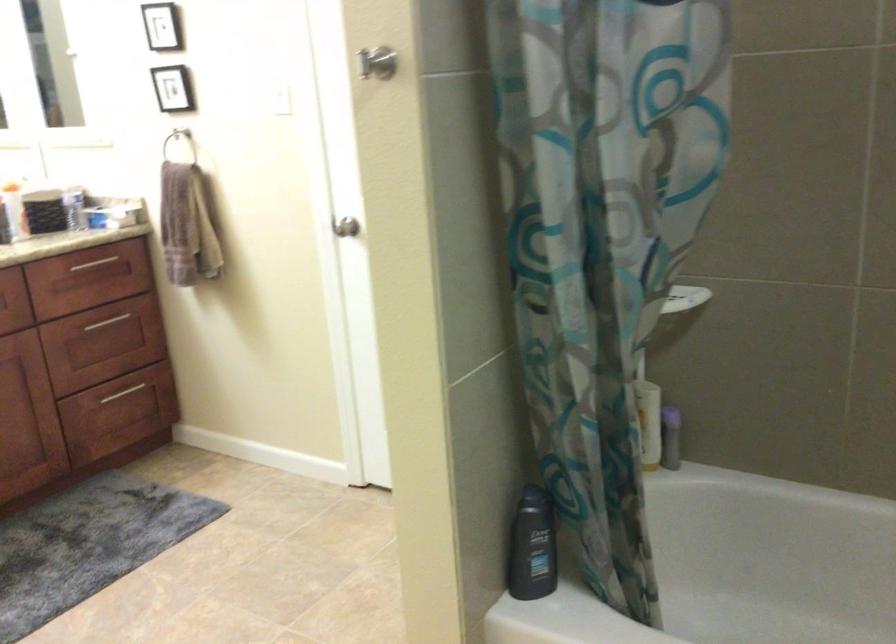
Image resolution: width=896 pixels, height=644 pixels. I want to click on silver doorknob, so click(x=346, y=227).